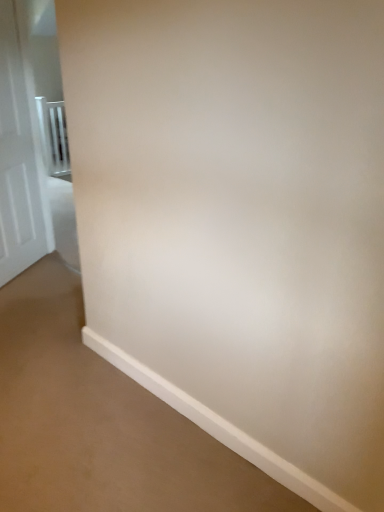
Question: Could you tell me if metallic silver balustrade at left is facing white glossy door at left?

Choices:
 (A) no
 (B) yes

Answer: (A)

Question: From the image's perspective, does metallic silver balustrade at left appear higher than white glossy door at left?

Choices:
 (A) yes
 (B) no

Answer: (A)

Question: Is metallic silver balustrade at left thinner than white glossy door at left?

Choices:
 (A) no
 (B) yes

Answer: (A)

Question: Considering the relative positions of metallic silver balustrade at left and white glossy door at left in the image provided, is metallic silver balustrade at left to the left of white glossy door at left from the viewer's perspective?

Choices:
 (A) yes
 (B) no

Answer: (A)

Question: Considering the relative sizes of metallic silver balustrade at left and white glossy door at left in the image provided, is metallic silver balustrade at left smaller than white glossy door at left?

Choices:
 (A) yes
 (B) no

Answer: (A)

Question: From the image's perspective, is metallic silver balustrade at left below white glossy door at left?

Choices:
 (A) no
 (B) yes

Answer: (A)

Question: Are white glossy door at left and metallic silver balustrade at left beside each other?

Choices:
 (A) no
 (B) yes

Answer: (A)

Question: From a real-world perspective, is white glossy door at left on top of metallic silver balustrade at left?

Choices:
 (A) yes
 (B) no

Answer: (A)

Question: Could you tell me if white glossy door at left is facing metallic silver balustrade at left?

Choices:
 (A) yes
 (B) no

Answer: (B)

Question: Can you confirm if white glossy door at left is positioned to the right of metallic silver balustrade at left?

Choices:
 (A) yes
 (B) no

Answer: (A)

Question: Does white glossy door at left have a greater width compared to metallic silver balustrade at left?

Choices:
 (A) no
 (B) yes

Answer: (A)

Question: Considering the relative sizes of white glossy door at left and metallic silver balustrade at left in the image provided, is white glossy door at left taller than metallic silver balustrade at left?

Choices:
 (A) yes
 (B) no

Answer: (A)

Question: Which is correct: metallic silver balustrade at left is inside white glossy door at left, or outside of it?

Choices:
 (A) inside
 (B) outside

Answer: (B)